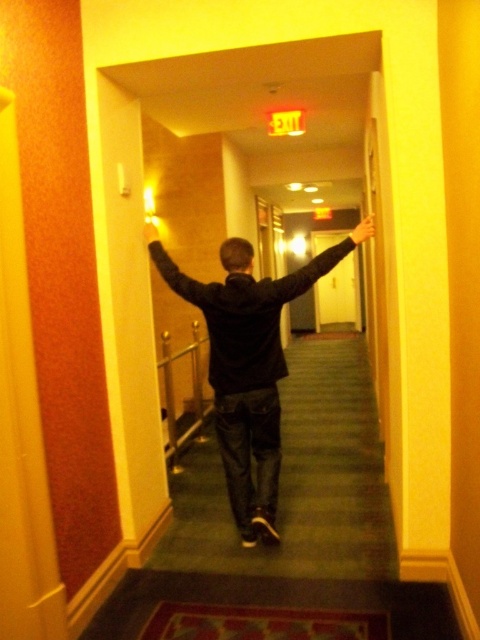
You are standing in the hallway and want to reach the yellow matte door at center. Which direction should you move relative to the dark gray hoodie at center?

The dark gray hoodie at center is below the yellow matte door at center, so you should move upward or forward in the hallway towards the yellow matte door at center to reach it.

You are an observer standing at the entrance of the hallway. You notice a dark gray hoodie at center and a smooth yellow hand at center. Which object appears bigger in the image?

The dark gray hoodie at center has a larger size compared to the smooth yellow hand at center, so the dark gray hoodie at center appears bigger in the image.

You are a photographer positioned at the end of the hallway. You want to take a photo of the dark gray hoodie at center so that it fills the frame without cropping any part of it. The camera has a focal length of 50mm and a sensor size of 24x36mm. What is the minimum distance you need to move closer to the subject to achieve this?

The dark gray hoodie at center is currently 2.60 meters away. To fill the frame, the photographer must ensure the hoodie occupies the entire 24mm height of the sensor. Using the formula for minimum distance, the photographer needs to move closer to approximately 1.3 meters from the hoodie.